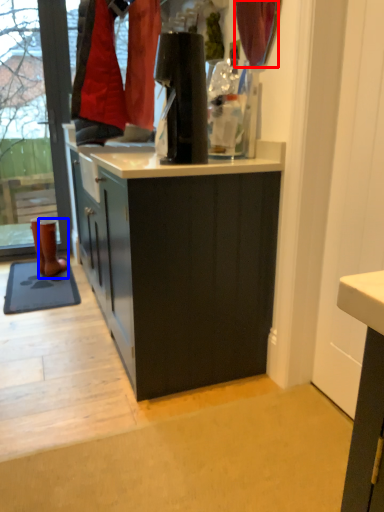
Question: Which object appears farthest to the camera in this image, curtain (highlighted by a red box) or footwear (highlighted by a blue box)?

Choices:
 (A) curtain
 (B) footwear

Answer: (B)